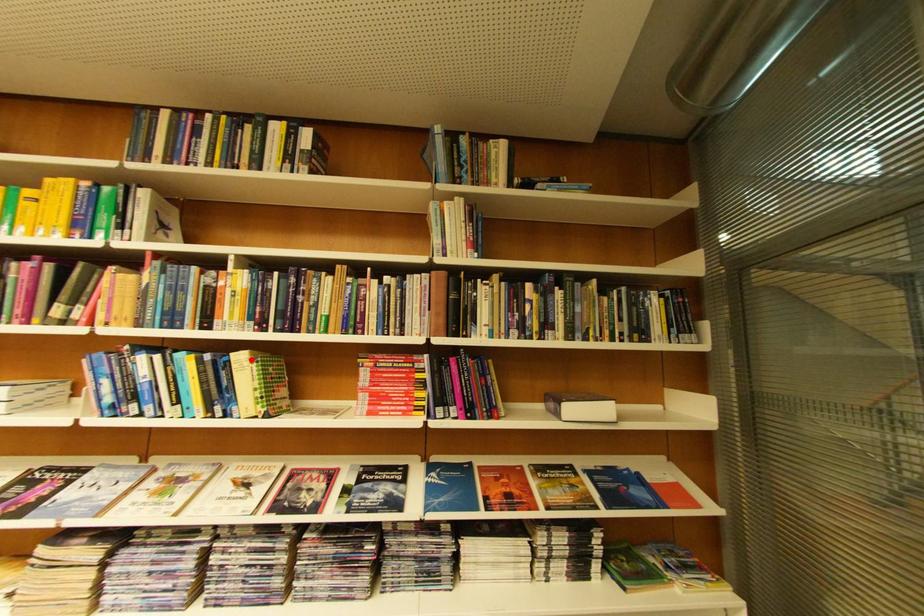
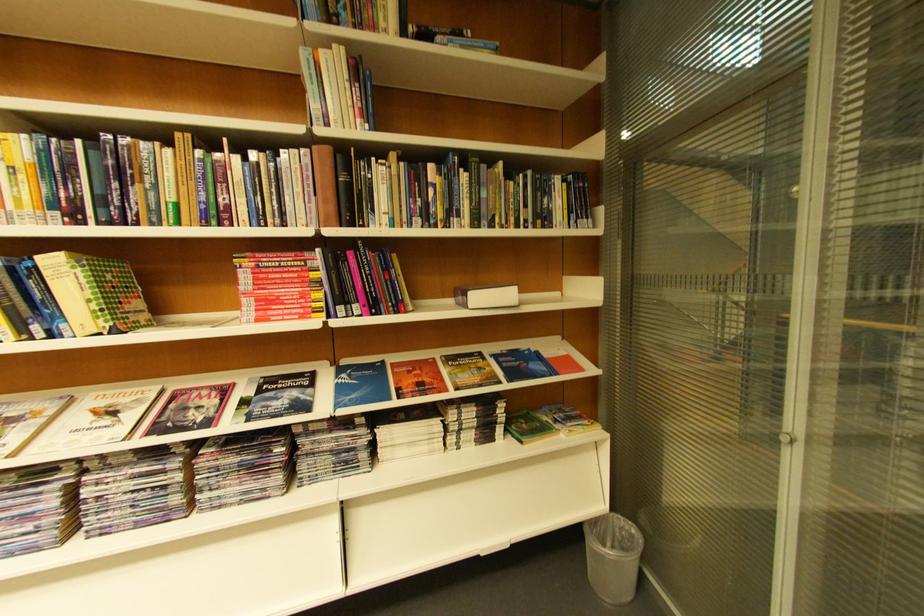
Find the pixel in the second image that matches the highlighted location in the first image.

(63, 264)